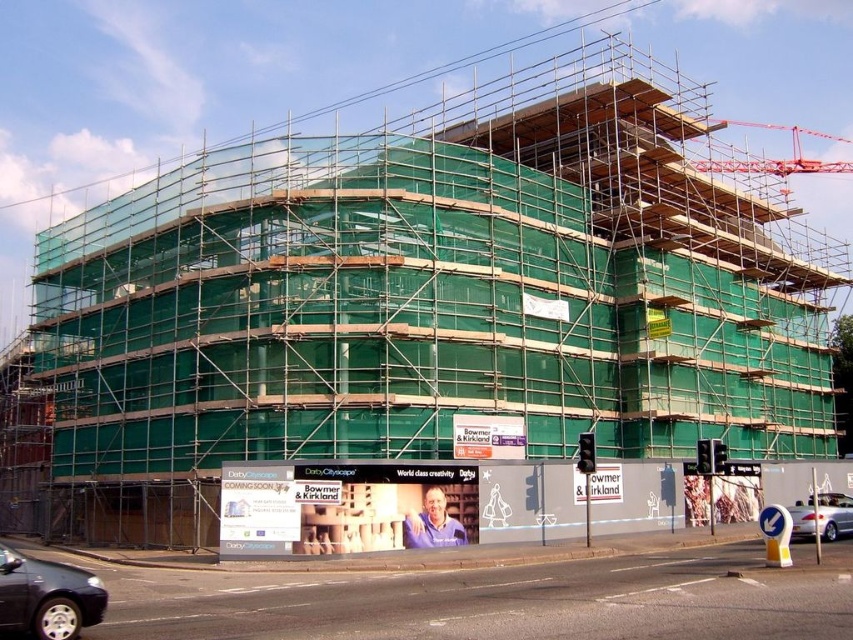
Question: Which point appears closest to the camera in this image?

Choices:
 (A) (795, 513)
 (B) (13, 627)

Answer: (B)

Question: Can you confirm if shiny black sedan at lower left is positioned to the right of silver metallic car at lower right?

Choices:
 (A) yes
 (B) no

Answer: (B)

Question: Which point is closer to the camera taking this photo?

Choices:
 (A) (795, 524)
 (B) (64, 624)

Answer: (B)

Question: Which point is farther from the camera taking this photo?

Choices:
 (A) (94, 586)
 (B) (842, 525)

Answer: (B)

Question: Does shiny black sedan at lower left come in front of silver metallic car at lower right?

Choices:
 (A) no
 (B) yes

Answer: (B)

Question: Is shiny black sedan at lower left closer to the viewer compared to silver metallic car at lower right?

Choices:
 (A) no
 (B) yes

Answer: (B)